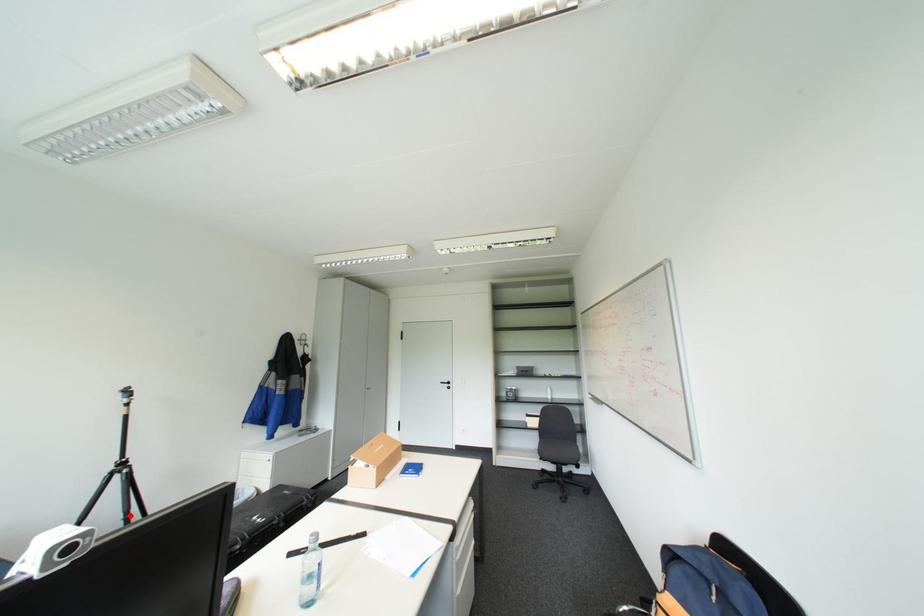
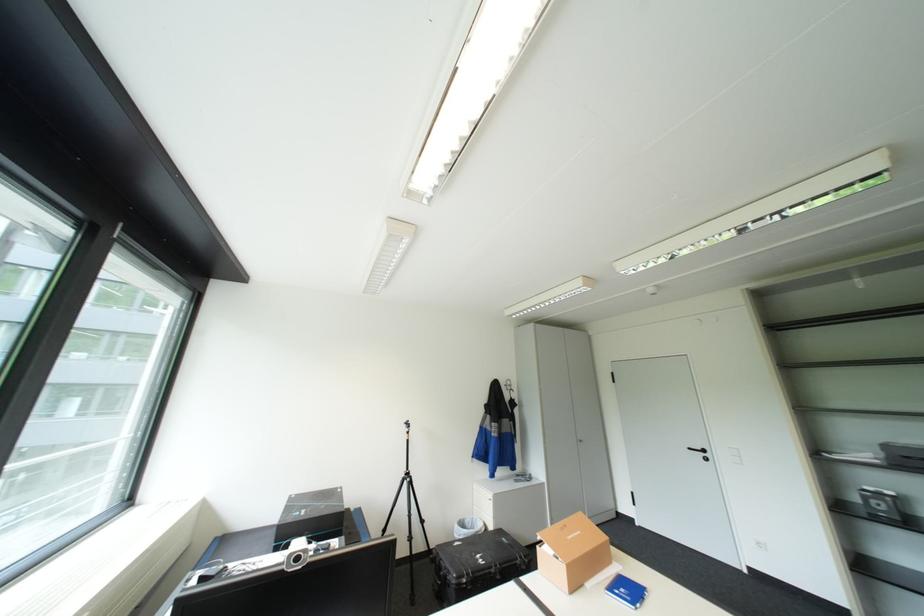
Find the pixel in the second image that matches the highlighted location in the first image.

(416, 512)